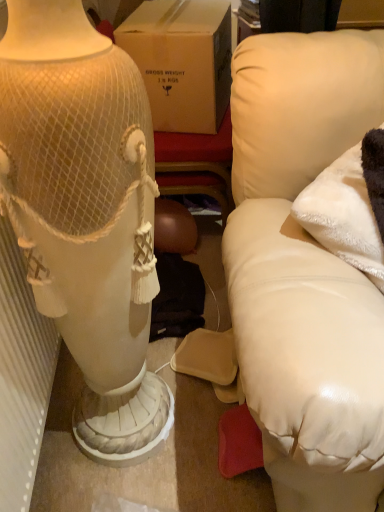
Question: Looking at their shapes, would you say white fluffy pillow at right is wider or thinner than white leather couch at right?

Choices:
 (A) wide
 (B) thin

Answer: (B)

Question: Is white fluffy pillow at right in front of or behind white leather couch at right in the image?

Choices:
 (A) front
 (B) behind

Answer: (B)

Question: Which is farther from the white fluffy pillow at right?

Choices:
 (A) white textured radiator at left
 (B) white leather couch at right

Answer: (A)

Question: Which of these objects is positioned farthest from the white textured radiator at left?

Choices:
 (A) white leather couch at right
 (B) white fluffy pillow at right

Answer: (B)